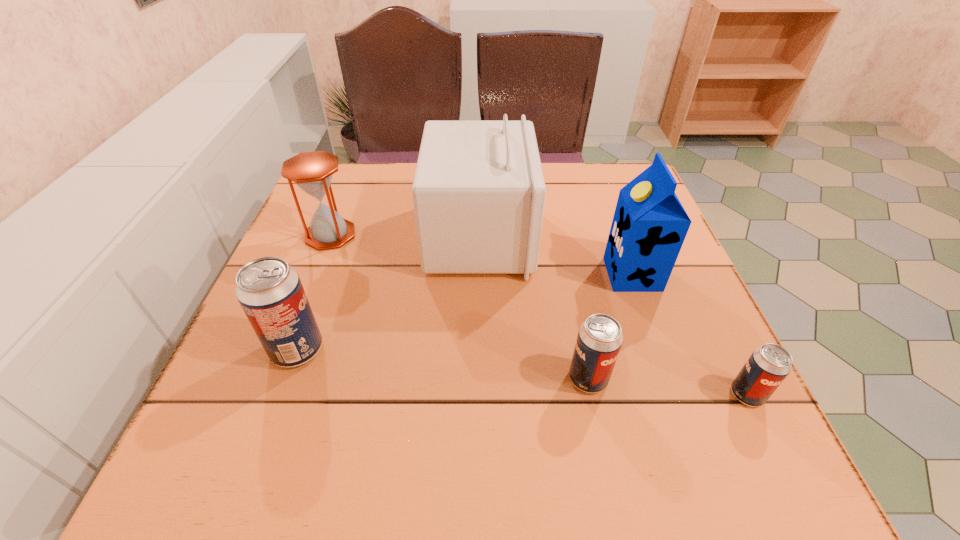
Locate an element on the screen. Image resolution: width=960 pixels, height=540 pixels. carton at the right edge is located at coordinates (649, 226).

Where is `object that is at the near right corner`? The width and height of the screenshot is (960, 540). object that is at the near right corner is located at coordinates (767, 367).

I want to click on free space at the far edge of the desktop, so click(x=406, y=191).

The width and height of the screenshot is (960, 540). Find the location of `vacant space at the near edge of the desktop`. vacant space at the near edge of the desktop is located at coordinates (474, 416).

I want to click on free region at the left edge, so click(287, 260).

Image resolution: width=960 pixels, height=540 pixels. I want to click on vacant region at the right edge of the desktop, so (631, 295).

The width and height of the screenshot is (960, 540). I want to click on vacant space at the near right corner, so click(744, 419).

Identify the location of free spot between the carton and the shortest object. (689, 334).

Find the location of `vacant area between the hourglass and the fourth object from left to right`. vacant area between the hourglass and the fourth object from left to right is located at coordinates (459, 307).

Where is `unoccupied position between the shortest beer can and the tallest beer can`? Image resolution: width=960 pixels, height=540 pixels. unoccupied position between the shortest beer can and the tallest beer can is located at coordinates (522, 372).